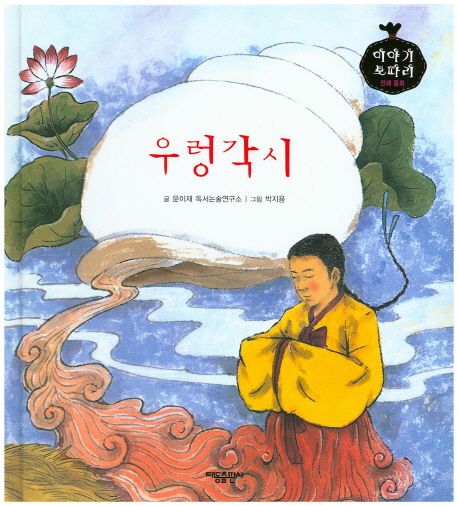
Where is `sash`? This screenshot has width=458, height=506. sash is located at coordinates (289, 423).